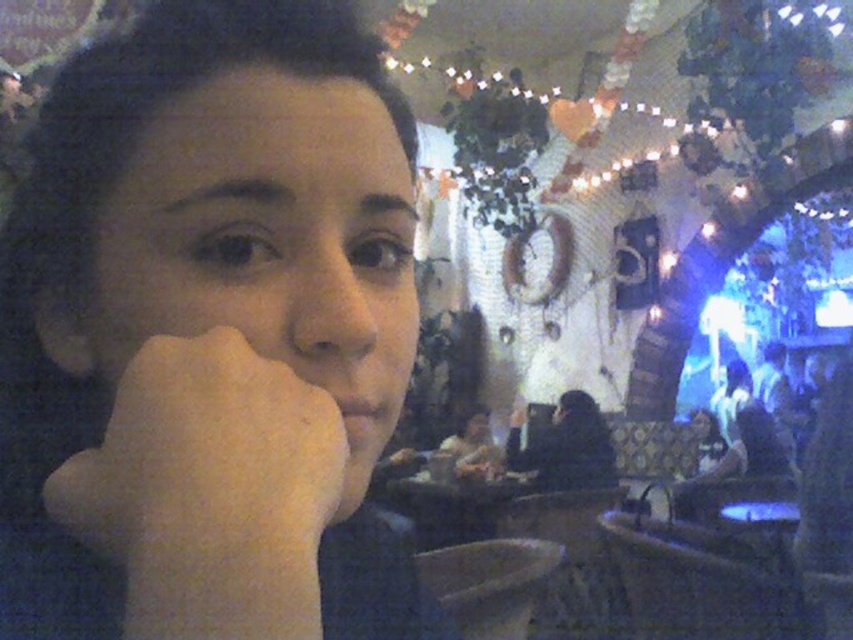
Question: Which point appears closest to the camera in this image?

Choices:
 (A) (550, 448)
 (B) (444, 618)
 (C) (445, 451)
 (D) (267, 616)

Answer: (D)

Question: From the image, what is the correct spatial relationship of white matte hand at lower left in relation to matte black hair at center?

Choices:
 (A) right
 (B) left

Answer: (B)

Question: Does smooth skin nose at center appear on the left side of matte black hair at center?

Choices:
 (A) no
 (B) yes

Answer: (B)

Question: Estimate the real-world distances between objects in this image. Which object is closer to the smooth skin at center?

Choices:
 (A) black matte jacket at center
 (B) matte black hair at center
 (C) white matte hand at lower left

Answer: (C)

Question: Does white matte hand at lower left have a smaller size compared to black matte jacket at center?

Choices:
 (A) yes
 (B) no

Answer: (A)

Question: Among these points, which one is nearest to the camera?

Choices:
 (A) (561, 433)
 (B) (341, 282)
 (C) (54, 516)
 (D) (480, 467)

Answer: (C)